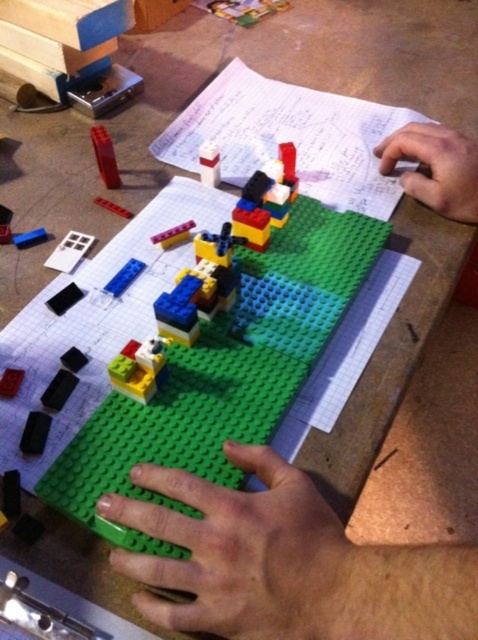
What do you see at coordinates (173, 234) in the screenshot? This screenshot has width=478, height=640. I see `translucent purple brick at center` at bounding box center [173, 234].

At what (x,y) coordinates should I click in order to perform the action: click on translucent purple brick at center. Please return your answer as a coordinate pair (x, y). Looking at the image, I should click on (173, 234).

Is black matte rectangular block at lower left smaller than matte black block at lower left?

No.

Who is more distant from viewer, (58, 404) or (17, 378)?

The point (17, 378) is more distant.

Measure the distance between black matte rectangular block at lower left and camera.

black matte rectangular block at lower left is 19.99 inches from camera.

This screenshot has width=478, height=640. I want to click on black matte rectangular block at lower left, so click(x=58, y=388).

In the scene shown: Can you confirm if white plastic door at lower left is positioned above translucent red brick at center?

No, white plastic door at lower left is not above translucent red brick at center.

In the scene shown: Can you confirm if white plastic door at lower left is positioned below translucent red brick at center?

Indeed, white plastic door at lower left is positioned under translucent red brick at center.

Measure the distance between point (76, 260) and camera.

Point (76, 260) is 24.92 inches from camera.

Find the location of `white plastic door at lower left`. white plastic door at lower left is located at coordinates (69, 252).